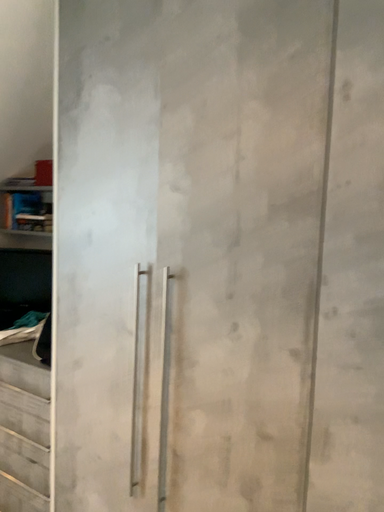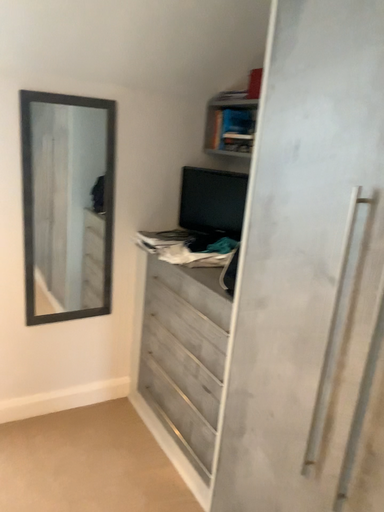
Question: Which way did the camera rotate in the video?

Choices:
 (A) rotated right
 (B) rotated left

Answer: (B)